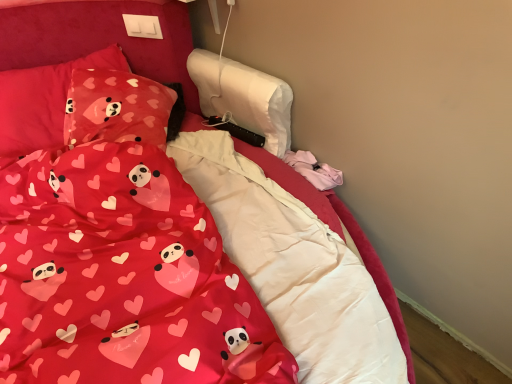
Question: In the image, is matte fabric pillow at upper left, which appears as the 1th pillow when viewed from the right, positioned in front of or behind matte red fabric at center?

Choices:
 (A) behind
 (B) front

Answer: (A)

Question: In terms of width, does matte fabric pillow at upper left, which appears as the 1th pillow when viewed from the right, look wider or thinner when compared to matte red fabric at center?

Choices:
 (A) wide
 (B) thin

Answer: (B)

Question: Based on their relative distances, which object is farther from the matte fabric pillow at upper left, which appears as the 1th pillow when viewed from the right?

Choices:
 (A) matte red fabric at center
 (B) matte pink fabric pillow at upper left, which is the second pillow in right-to-left order

Answer: (A)

Question: Which object is positioned closest to the matte fabric pillow at upper left, which is the second pillow in left-to-right order?

Choices:
 (A) matte red fabric at center
 (B) matte pink fabric pillow at upper left, the 1th pillow viewed from the left

Answer: (B)